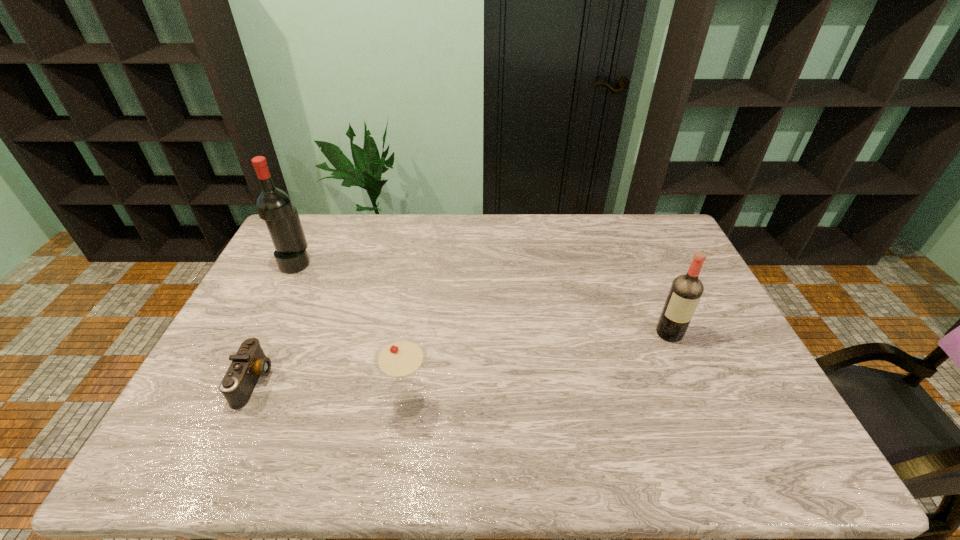
The image size is (960, 540). In the image, there is a desktop. Find the location of `vacant space at the far right corner`. vacant space at the far right corner is located at coordinates pyautogui.click(x=649, y=214).

The image size is (960, 540). Find the location of `vacant area that lies between the tallest object and the martini`. vacant area that lies between the tallest object and the martini is located at coordinates (352, 333).

This screenshot has width=960, height=540. Find the location of `unoccupied position between the camera and the wine bottle`. unoccupied position between the camera and the wine bottle is located at coordinates (275, 322).

Where is `free space that is in between the second shortest object and the farthest object`? free space that is in between the second shortest object and the farthest object is located at coordinates coord(352,333).

This screenshot has width=960, height=540. What are the coordinates of `vacant region between the martini and the camera` in the screenshot? It's located at (331, 392).

Find the location of `vacant point located between the second farthest object and the wine bottle`. vacant point located between the second farthest object and the wine bottle is located at coordinates (483, 298).

Find the location of a particular element. The image size is (960, 540). vacant space that's between the tallest object and the second farthest object is located at coordinates (483, 298).

You are a GUI agent. You are given a task and a screenshot of the screen. Output one action in this format:
    pyautogui.click(x=<x>, y=<y>)
    Task: Click on the empty location between the camera and the third object from left to right
    
    Given the screenshot: What is the action you would take?
    pyautogui.click(x=331, y=392)

The image size is (960, 540). I want to click on vacant point located between the second tallest object and the shortest object, so click(462, 357).

Locate an element on the screen. free space that is in between the tallest object and the second tallest object is located at coordinates (483, 298).